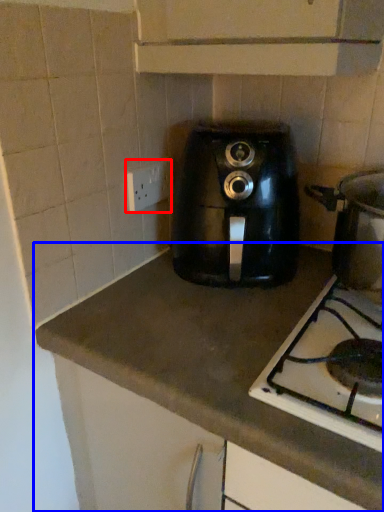
Question: Which object appears farthest to the camera in this image, electric outlet (highlighted by a red box) or countertop (highlighted by a blue box)?

Choices:
 (A) electric outlet
 (B) countertop

Answer: (A)